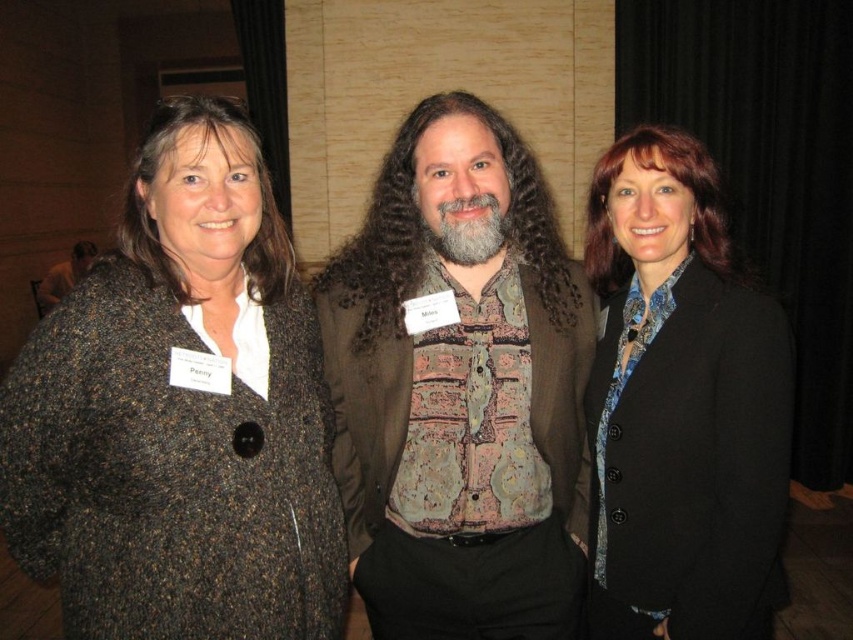
Is paisley fabric shirt at center shorter than brown textured coat at center?

No, paisley fabric shirt at center is not shorter than brown textured coat at center.

Is paisley fabric shirt at center smaller than brown textured coat at center?

Yes, paisley fabric shirt at center is smaller than brown textured coat at center.

Describe the element at coordinates (459, 388) in the screenshot. The image size is (853, 640). I see `paisley fabric shirt at center` at that location.

At what (x,y) coordinates should I click in order to perform the action: click on paisley fabric shirt at center. Please return your answer as a coordinate pair (x, y). This screenshot has height=640, width=853. Looking at the image, I should click on (459, 388).

Between point (753, 451) and point (465, 250), which one is positioned in front?

Positioned in front is point (753, 451).

From the picture: Which of these two, black textured blazer at center or graywoollybeard at center, stands taller?

With more height is black textured blazer at center.

Between point (717, 577) and point (427, 224), which one is positioned in front?

Point (717, 577) is more forward.

In order to click on black textured blazer at center in this screenshot , I will do `click(682, 406)`.

Can you confirm if knitted brown coat at left is shorter than black textured blazer at center?

Yes.

Between point (55, 404) and point (753, 561), which one is positioned in front?

Point (55, 404) is in front.

Measure the distance between knitted brown coat at left and camera.

knitted brown coat at left is 1.18 meters from camera.

I want to click on knitted brown coat at left, so click(x=178, y=413).